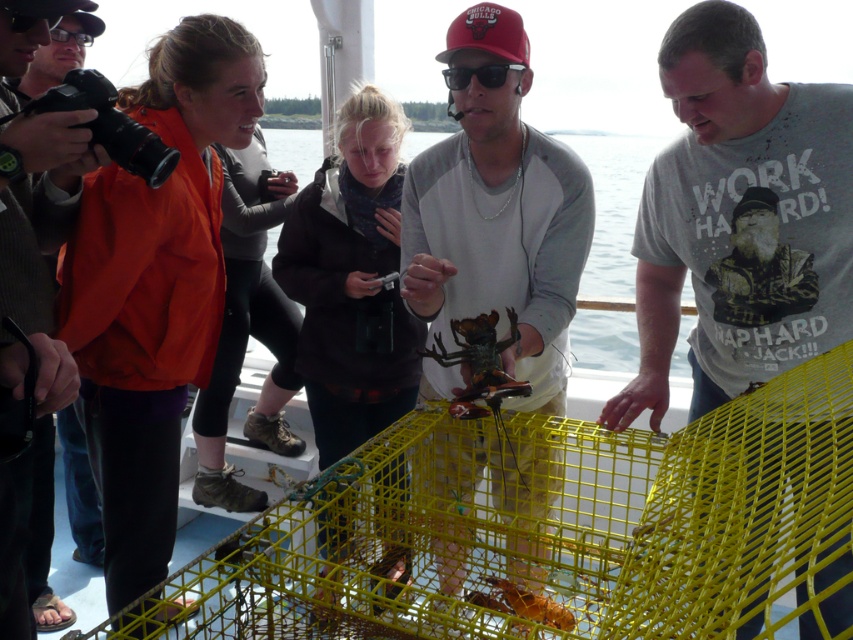
Does shiny metallic lobster at center have a greater height compared to matte black camera at left?

No, shiny metallic lobster at center is not taller than matte black camera at left.

This screenshot has height=640, width=853. What do you see at coordinates (497, 218) in the screenshot?
I see `shiny metallic lobster at center` at bounding box center [497, 218].

Identify the location of shiny metallic lobster at center. The width and height of the screenshot is (853, 640). (497, 218).

Is point (3, 620) farther from viewer compared to point (461, 80)?

No, (3, 620) is in front of (461, 80).

Is point (76, 163) in front of point (490, 81)?

Yes, it is in front of point (490, 81).

Measure the distance between matte black camera at left and camera.

They are 4.02 feet apart.

Locate an element on the screen. The height and width of the screenshot is (640, 853). matte black camera at left is located at coordinates (39, 232).

Does gray cotton t-shirt at center appear over shiny metallic lobster at center?

Correct, gray cotton t-shirt at center is located above shiny metallic lobster at center.

You are a GUI agent. You are given a task and a screenshot of the screen. Output one action in this format:
    pyautogui.click(x=<x>, y=<y>)
    Task: Click on the gray cotton t-shirt at center
    This screenshot has height=640, width=853.
    Given the screenshot: What is the action you would take?
    pyautogui.click(x=740, y=220)